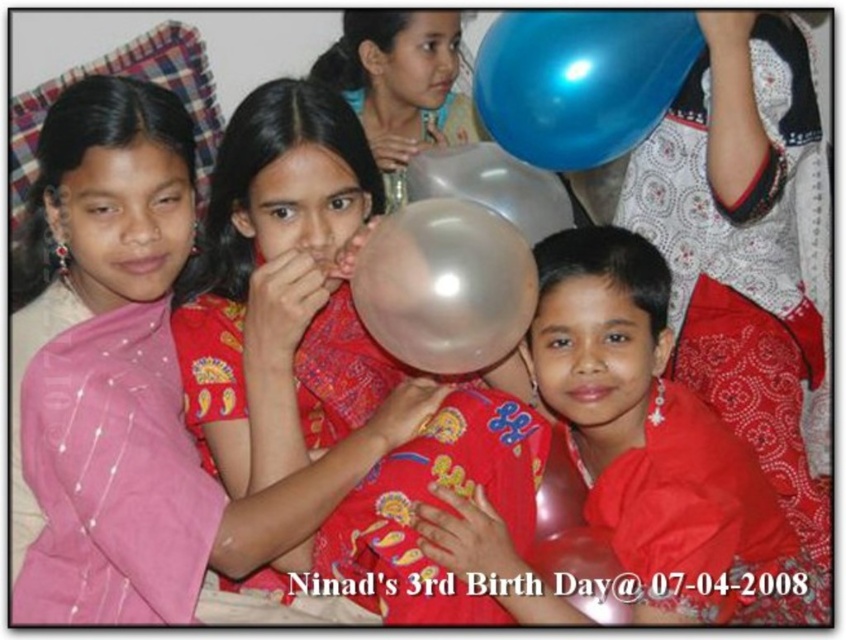
You are a photographer standing at the center of the room. You want to capture a photo of the translucent plastic balloon at center. Where should you aim your camera to ensure the balloon is in the center of the photo?

The translucent plastic balloon at center is already positioned at point (279, 289), so you should aim your camera directly at that coordinate to center it in the photo.

You are a party planner organizing a birthday event. You need to ensure that two balloons, the translucent plastic balloon at center and the transparent plastic balloon at center, are spaced exactly 6 inches apart for a decoration display. Based on the image provided, will the current spacing between them meet your requirement?

The translucent plastic balloon at center and the transparent plastic balloon at center are 6.19 inches apart from each other, which is slightly more than the required 6 inches. Therefore, the current spacing meets the requirement as it exceeds the minimum distance needed.

You are a photographer trying to capture a clear shot of the translucent plastic balloon at center and the shiny blue balloon at upper right. Which balloon will appear larger in the photo?

The translucent plastic balloon at center will appear larger in the photo because it is closer to the viewer than the shiny blue balloon at upper right.